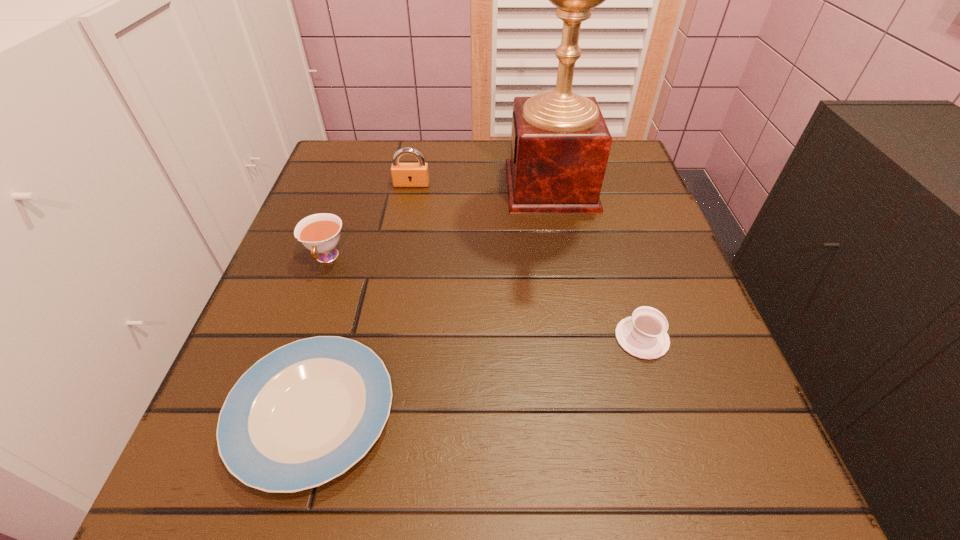
At what (x,y) coordinates should I click in order to perform the action: click on free location located 0.310m to unlock the second tallest object from the front. Please return your answer as a coordinate pair (x, y). This screenshot has height=540, width=960. Looking at the image, I should click on (392, 288).

Find the location of a particular element. vacant space situated on the side of the taller teacup with the handle is located at coordinates click(244, 496).

Where is `free region located on the handle side of the shorter teacup`? free region located on the handle side of the shorter teacup is located at coordinates [x=602, y=211].

The image size is (960, 540). I want to click on vacant space situated on the handle side of the shorter teacup, so click(x=605, y=220).

The width and height of the screenshot is (960, 540). What are the coordinates of `free location located on the handle side of the shorter teacup` in the screenshot? It's located at (622, 275).

The width and height of the screenshot is (960, 540). I want to click on vacant region located 0.170m on the right of the plate, so click(x=515, y=414).

Where is `trophy cup that is at the far edge`? The image size is (960, 540). trophy cup that is at the far edge is located at coordinates (560, 143).

Where is `padlock located in the far edge section of the desktop`? padlock located in the far edge section of the desktop is located at coordinates (403, 174).

Image resolution: width=960 pixels, height=540 pixels. I want to click on object that is at the near edge, so click(304, 414).

In order to click on teacup at the left edge in this screenshot , I will do `click(320, 233)`.